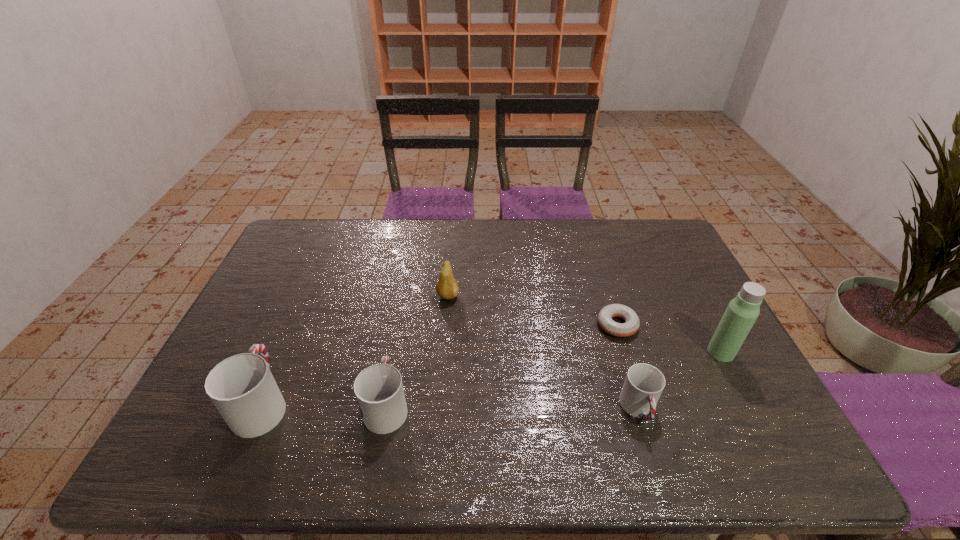
In order to click on doughnut in this screenshot , I will do `click(632, 323)`.

I want to click on the shortest object, so click(632, 323).

At what (x,y) coordinates should I click in order to perform the action: click on free spot located 0.390m on the side of the leftmost cup where the handle is located. Please return your answer as a coordinate pair (x, y). The width and height of the screenshot is (960, 540). Looking at the image, I should click on (318, 274).

The height and width of the screenshot is (540, 960). I want to click on free spot located on the side of the leftmost cup where the handle is located, so click(313, 285).

The image size is (960, 540). In order to click on vacant position located 0.310m on the side of the leftmost cup where the handle is located in this screenshot , I will do `click(310, 291)`.

I want to click on vacant space located on the side of the second tallest cup where the handle is located, so click(403, 317).

The height and width of the screenshot is (540, 960). In order to click on free region located on the side of the second tallest cup where the handle is located in this screenshot , I will do `click(397, 349)`.

Identify the location of free point located 0.050m on the side of the second tallest cup where the handle is located. (395, 364).

Where is `vacant point located 0.090m on the right of the third object from left to right`? vacant point located 0.090m on the right of the third object from left to right is located at coordinates (489, 296).

The width and height of the screenshot is (960, 540). I want to click on vacant space located on the back of the thermos bottle, so click(677, 268).